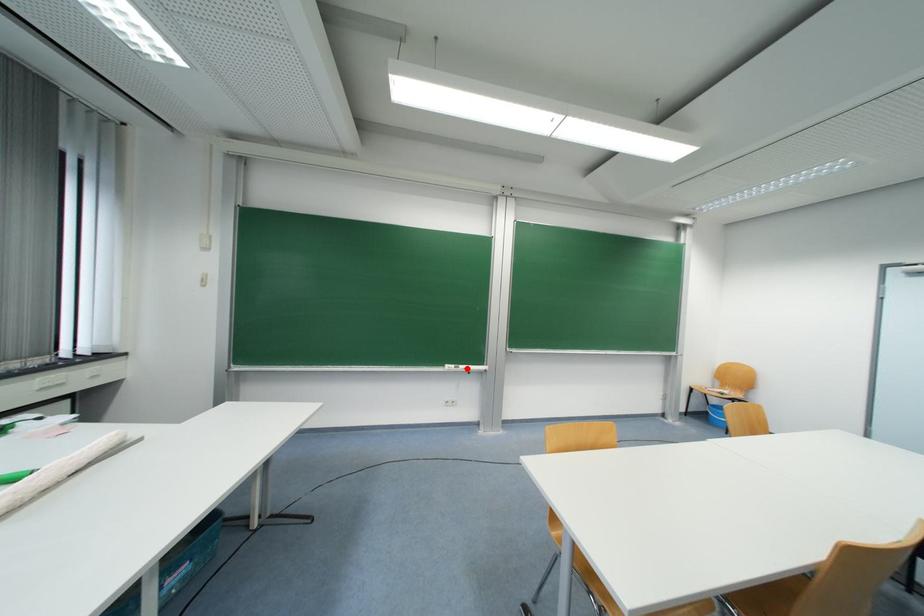
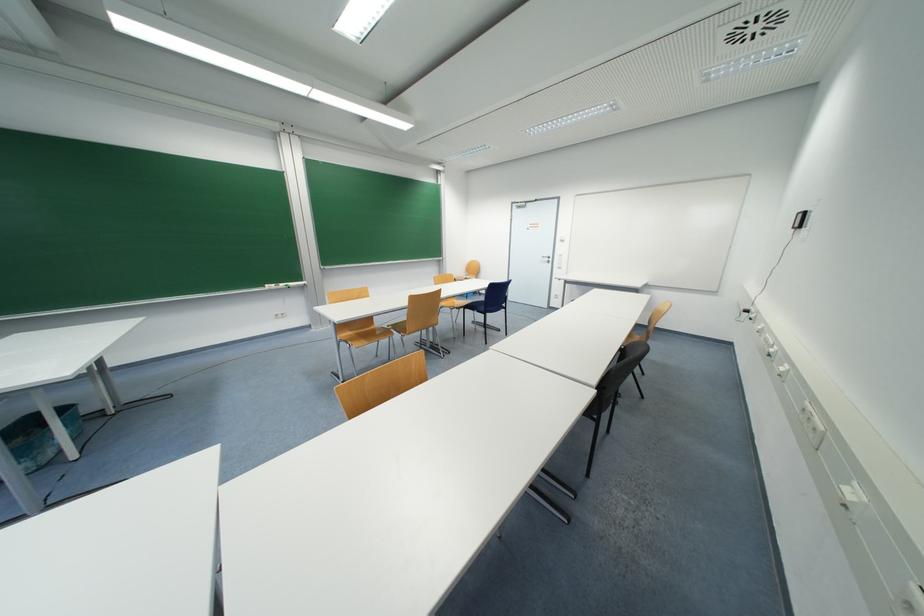
Question: A red point is marked in image1. In image2, is the corresponding 3D point closer to the camera or farther? Reply with the corresponding letter.

Choices:
 (A) The corresponding 3D point is closer.
 (B) The corresponding 3D point is farther.

Answer: (A)